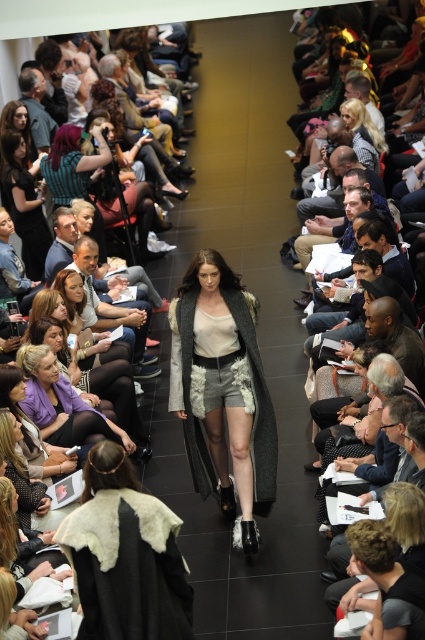
Who is positioned more to the left, gray textured coat at center or matte black dress at left?

matte black dress at left is more to the left.

This screenshot has height=640, width=425. I want to click on gray textured coat at center, so click(x=223, y=392).

What do you see at coordinates (223, 392) in the screenshot?
I see `gray textured coat at center` at bounding box center [223, 392].

This screenshot has width=425, height=640. Identify the location of gray textured coat at center. pos(223,392).

Is the position of purple fabric coat at lower left more distant than that of matte black hair at upper left?

No, purple fabric coat at lower left is closer to the viewer.

Between point (79, 406) and point (5, 129), which one is positioned in front?

Point (79, 406) is more forward.

Where is `purple fabric coat at lower left`? The width and height of the screenshot is (425, 640). purple fabric coat at lower left is located at coordinates (62, 404).

Between gray textured coat at center and purple fabric coat at lower left, which one appears on the left side from the viewer's perspective?

purple fabric coat at lower left

This screenshot has width=425, height=640. In order to click on gray textured coat at center in this screenshot , I will do `click(223, 392)`.

Where is `gray textured coat at center`? The height and width of the screenshot is (640, 425). gray textured coat at center is located at coordinates (223, 392).